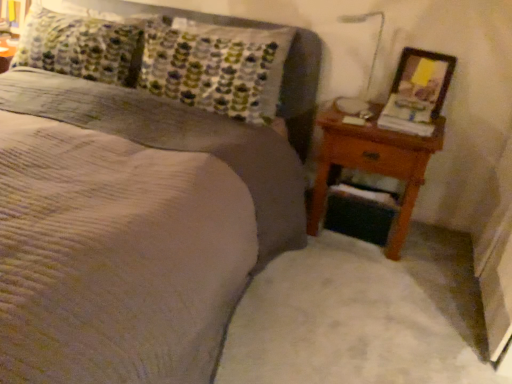
The width and height of the screenshot is (512, 384). What do you see at coordinates (423, 80) in the screenshot?
I see `wooden picture frame at right` at bounding box center [423, 80].

Locate an element on the screen. The width and height of the screenshot is (512, 384). brown wooden nightstand at right is located at coordinates tap(372, 165).

Is brown wooden nightstand at right smaller than wooden picture frame at right?

Actually, brown wooden nightstand at right might be larger than wooden picture frame at right.

Between brown wooden nightstand at right and wooden picture frame at right, which one has smaller width?

wooden picture frame at right.

How different are the orientations of brown wooden nightstand at right and wooden picture frame at right in degrees?

The angular difference between brown wooden nightstand at right and wooden picture frame at right is 0.133 degrees.

I want to click on bed positioned vertically above the brown wooden nightstand at right (from a real-world perspective), so [134, 238].

Is brown wooden nightstand at right positioned beyond the bounds of textured gray bed at center?

No, brown wooden nightstand at right is not outside of textured gray bed at center.

Is brown wooden nightstand at right directly adjacent to textured gray bed at center?

No, brown wooden nightstand at right is not next to textured gray bed at center.

From the image's perspective, would you say brown wooden nightstand at right is shown under textured gray bed at center?

Yes, from the image's perspective, brown wooden nightstand at right is below textured gray bed at center.

Considering the points (143, 240) and (364, 153), which point is behind, point (143, 240) or point (364, 153)?

The point (364, 153) is behind.

Based on their positions, is textured gray bed at center located to the left or right of brown wooden nightstand at right?

textured gray bed at center is positioned on brown wooden nightstand at right's left side.

From the picture: Is brown wooden nightstand at right at the back of textured gray bed at center?

No.

From the image's perspective, is textured gray bed at center above brown wooden nightstand at right?

Yes, from the image's perspective, textured gray bed at center is on top of brown wooden nightstand at right.

At what (x,y) coordinates should I click in order to perform the action: click on bed in front of the wooden picture frame at right. Please return your answer as a coordinate pair (x, y). The image size is (512, 384). Looking at the image, I should click on (134, 238).

Between wooden picture frame at right and textured gray bed at center, which one has larger width?

With larger width is textured gray bed at center.

Is wooden picture frame at right at the left side of textured gray bed at center?

In fact, wooden picture frame at right is to the right of textured gray bed at center.

Can you tell me how much wooden picture frame at right and textured gray bed at center differ in facing direction?

The angle between the facing direction of wooden picture frame at right and the facing direction of textured gray bed at center is 3.27 degrees.

In terms of size, does wooden picture frame at right appear bigger or smaller than brown wooden nightstand at right?

wooden picture frame at right is smaller than brown wooden nightstand at right.

Which is behind, wooden picture frame at right or brown wooden nightstand at right?

wooden picture frame at right is further from the camera.

What's the angular difference between wooden picture frame at right and brown wooden nightstand at right's facing directions?

0.133 degrees.

From the image's perspective, is textured gray bed at center positioned above or below wooden picture frame at right?

Clearly, from the image's perspective, textured gray bed at center is below wooden picture frame at right.

Would you consider textured gray bed at center to be distant from wooden picture frame at right?

Yes.

Where is `bed lying on the left of wooden picture frame at right`? The width and height of the screenshot is (512, 384). bed lying on the left of wooden picture frame at right is located at coordinates (134, 238).

Measure the distance between textured gray bed at center and wooden picture frame at right.

textured gray bed at center and wooden picture frame at right are 1.09 meters apart.

Find the location of `nightstand on the left of wooden picture frame at right`. nightstand on the left of wooden picture frame at right is located at coordinates (372, 165).

The height and width of the screenshot is (384, 512). I want to click on bed that is above the brown wooden nightstand at right (from a real-world perspective), so click(x=134, y=238).

When comparing their distances from wooden picture frame at right, does textured gray bed at center or brown wooden nightstand at right seem further?

The object further to wooden picture frame at right is textured gray bed at center.

Based on the photo, from the image, which object appears to be farther from brown wooden nightstand at right, textured gray bed at center or wooden picture frame at right?

The object further to brown wooden nightstand at right is textured gray bed at center.

Looking at the image, which one is located further to brown wooden nightstand at right, wooden picture frame at right or textured gray bed at center?

Based on the image, textured gray bed at center appears to be further to brown wooden nightstand at right.

Estimate the real-world distances between objects in this image. Which object is closer to textured gray bed at center, wooden picture frame at right or brown wooden nightstand at right?

brown wooden nightstand at right is positioned closer to the anchor textured gray bed at center.

Considering their positions, is brown wooden nightstand at right positioned closer to wooden picture frame at right than textured gray bed at center?

The object closer to wooden picture frame at right is brown wooden nightstand at right.

Which object lies nearer to the anchor point textured gray bed at center, brown wooden nightstand at right or wooden picture frame at right?

Among the two, brown wooden nightstand at right is located nearer to textured gray bed at center.

Locate an element on the screen. nightstand located between textured gray bed at center and wooden picture frame at right in the depth direction is located at coordinates (372, 165).